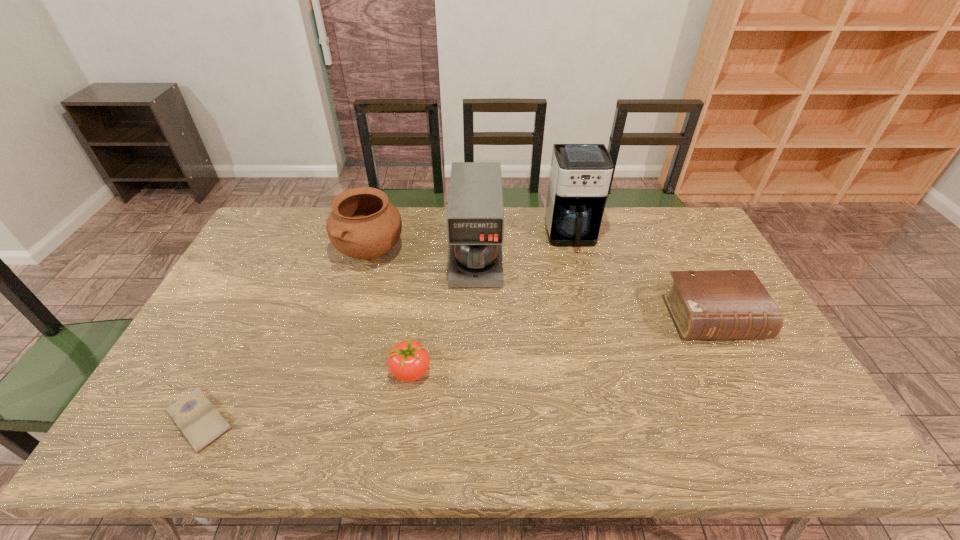
Locate an element on the screen. vacant space that is in between the pottery and the rightmost object is located at coordinates (541, 285).

Image resolution: width=960 pixels, height=540 pixels. I want to click on unoccupied area between the tallest object and the Bible, so click(642, 277).

Where is `blank region between the fifth object from right to left and the leftmost object`? The image size is (960, 540). blank region between the fifth object from right to left and the leftmost object is located at coordinates 285,335.

Find the location of a particular element. The height and width of the screenshot is (540, 960). unoccupied position between the leftmost object and the Bible is located at coordinates (456, 369).

Identify the location of vacant area between the shorter coffee maker and the third nearest object. The image size is (960, 540). (594, 287).

Identify the location of free area in between the second nearest object and the rightmost object. (562, 345).

Image resolution: width=960 pixels, height=540 pixels. I want to click on vacant area that lies between the shorter coffee maker and the leftmost object, so click(338, 338).

I want to click on vacant point located between the Bible and the third tallest object, so click(x=541, y=285).

Select which object is the third closest to the fifth object from right to left. Please provide its 2D coordinates. Your answer should be formatted as a tuple, i.e. [(x, y)], where the tuple contains the x and y coordinates of a point satisfying the conditions above.

[(201, 423)]

Identify which object is located as the second nearest to the fifth farthest object. Please provide its 2D coordinates. Your answer should be formatted as a tuple, i.e. [(x, y)], where the tuple contains the x and y coordinates of a point satisfying the conditions above.

[(363, 224)]